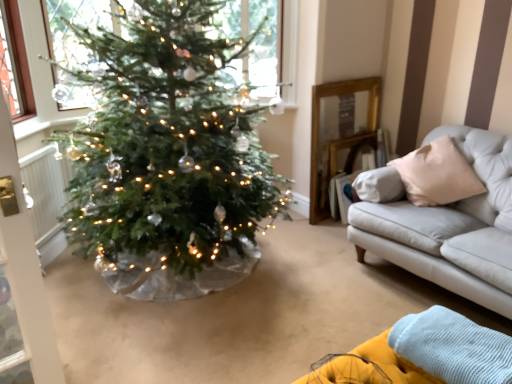
Question: Is white textured radiator at left thinner than yellow fabric couch at lower right?

Choices:
 (A) yes
 (B) no

Answer: (A)

Question: Is white textured radiator at left taller than yellow fabric couch at lower right?

Choices:
 (A) yes
 (B) no

Answer: (A)

Question: Is white textured radiator at left positioned far away from yellow fabric couch at lower right?

Choices:
 (A) no
 (B) yes

Answer: (B)

Question: From a real-world perspective, is white textured radiator at left beneath yellow fabric couch at lower right?

Choices:
 (A) no
 (B) yes

Answer: (A)

Question: Is white textured radiator at left completely or partially outside of yellow fabric couch at lower right?

Choices:
 (A) no
 (B) yes

Answer: (B)

Question: From a real-world perspective, relative to clear glass window at upper center, is yellow fabric couch at lower right vertically above or below?

Choices:
 (A) below
 (B) above

Answer: (A)

Question: Would you say yellow fabric couch at lower right is to the left or to the right of clear glass window at upper center in the picture?

Choices:
 (A) left
 (B) right

Answer: (B)

Question: From the image's perspective, is yellow fabric couch at lower right located above or below clear glass window at upper center?

Choices:
 (A) below
 (B) above

Answer: (A)

Question: Is yellow fabric couch at lower right spatially inside clear glass window at upper center, or outside of it?

Choices:
 (A) inside
 (B) outside

Answer: (B)

Question: From their relative heights in the image, would you say clear glass window at upper center is taller or shorter than yellow fabric couch at lower right?

Choices:
 (A) tall
 (B) short

Answer: (A)

Question: Considering their positions, is clear glass window at upper center located in front of or behind yellow fabric couch at lower right?

Choices:
 (A) behind
 (B) front

Answer: (A)

Question: Considering the relative positions of clear glass window at upper center and yellow fabric couch at lower right in the image provided, is clear glass window at upper center to the left or to the right of yellow fabric couch at lower right?

Choices:
 (A) left
 (B) right

Answer: (A)

Question: Is clear glass window at upper center inside or outside of yellow fabric couch at lower right?

Choices:
 (A) inside
 (B) outside

Answer: (B)

Question: Does point (399, 324) appear closer or farther from the camera than point (49, 216)?

Choices:
 (A) closer
 (B) farther

Answer: (A)

Question: Is yellow fabric couch at lower right in front of or behind white textured radiator at left in the image?

Choices:
 (A) front
 (B) behind

Answer: (A)